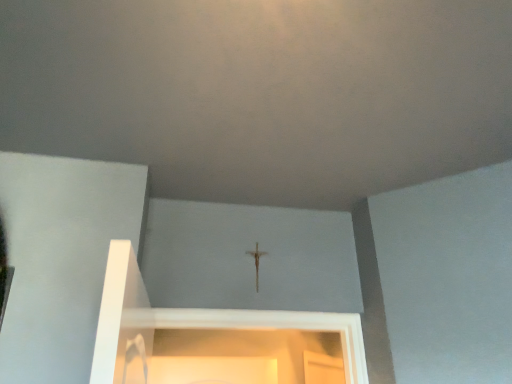
Where is `wooden crucifix at center`? The width and height of the screenshot is (512, 384). wooden crucifix at center is located at coordinates (256, 262).

Describe the element at coordinates (256, 262) in the screenshot. This screenshot has height=384, width=512. I see `wooden crucifix at center` at that location.

Measure the distance between point (257,263) and camera.

Point (257,263) and camera are 5.67 feet apart from each other.

Find the location of a particular element. The height and width of the screenshot is (384, 512). wooden crucifix at center is located at coordinates (256, 262).